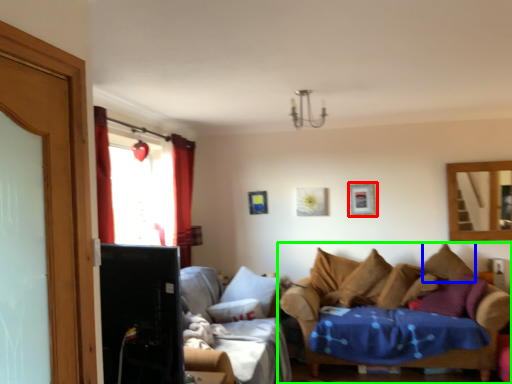
Question: Estimate the real-world distances between objects in this image. Which object is farther from picture frame (highlighted by a red box), pillow (highlighted by a blue box) or studio couch (highlighted by a green box)?

Choices:
 (A) pillow
 (B) studio couch

Answer: (A)